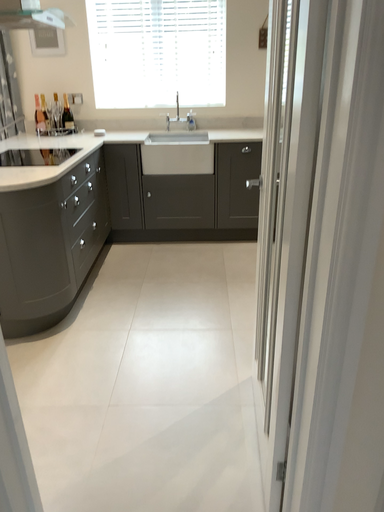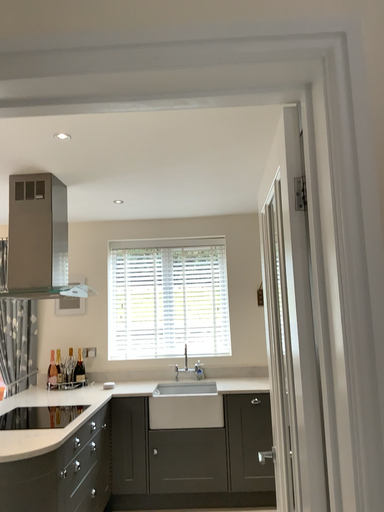
Question: Which way did the camera rotate in the video?

Choices:
 (A) rotated upward
 (B) rotated downward

Answer: (A)